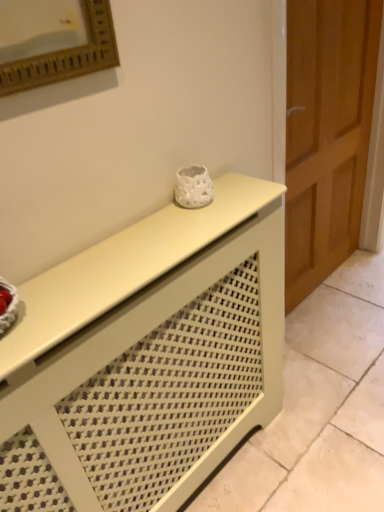
Locate an element on the screen. Image resolution: width=384 pixels, height=512 pixels. empty space that is ontop of matte white console table at center (from a real-world perspective) is located at coordinates (93, 259).